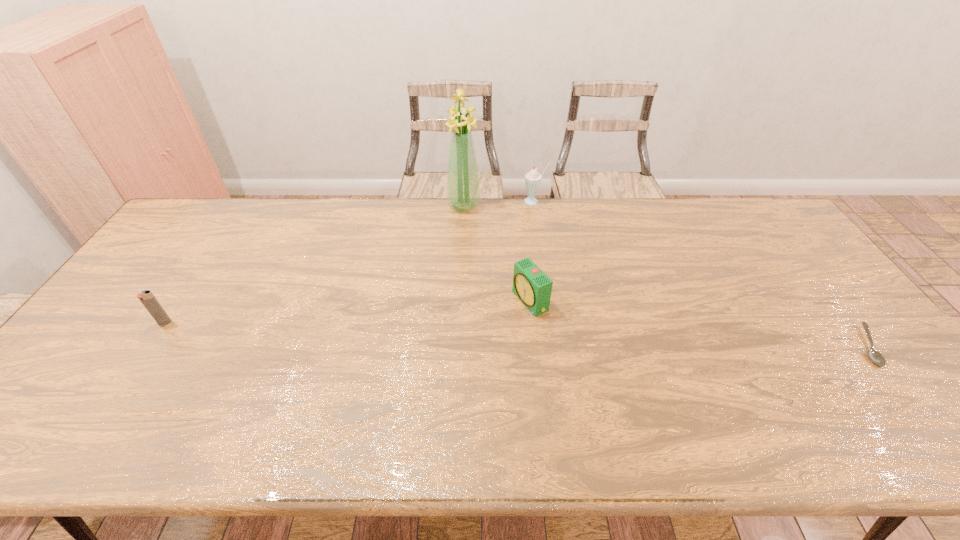
What are the coordinates of `free spot between the alarm clock and the milkshake` in the screenshot? It's located at click(x=532, y=251).

You are a GUI agent. You are given a task and a screenshot of the screen. Output one action in this format:
    pyautogui.click(x=<x>, y=<y>)
    Task: Click on the empty space that is in between the third farthest object and the second object from left to right
    The width and height of the screenshot is (960, 540).
    Given the screenshot: What is the action you would take?
    pyautogui.click(x=497, y=253)

At what (x,y) coordinates should I click in order to perform the action: click on empty space between the leftmost object and the bouquet. Please return your answer as a coordinate pair (x, y). The height and width of the screenshot is (540, 960). Looking at the image, I should click on (314, 264).

This screenshot has height=540, width=960. What are the coordinates of `blank region between the second tallest object and the soupspoon` in the screenshot? It's located at (701, 274).

What are the coordinates of `unoccupied area between the rightmost object and the igniter` in the screenshot? It's located at (516, 334).

Where is `vacant area that lies between the fourth object from right to left and the milkshake`? This screenshot has width=960, height=540. vacant area that lies between the fourth object from right to left and the milkshake is located at coordinates [499, 204].

Find the location of `unoccupied position between the bouquet and the milkshake`. unoccupied position between the bouquet and the milkshake is located at coordinates (499, 204).

The height and width of the screenshot is (540, 960). Find the location of `free space that is in between the alarm clock and the tallest object`. free space that is in between the alarm clock and the tallest object is located at coordinates (497, 253).

Locate an element on the screen. The height and width of the screenshot is (540, 960). the closest object to the shortest object is located at coordinates point(531,285).

This screenshot has width=960, height=540. I want to click on object that is the closest to the alarm clock, so click(x=463, y=189).